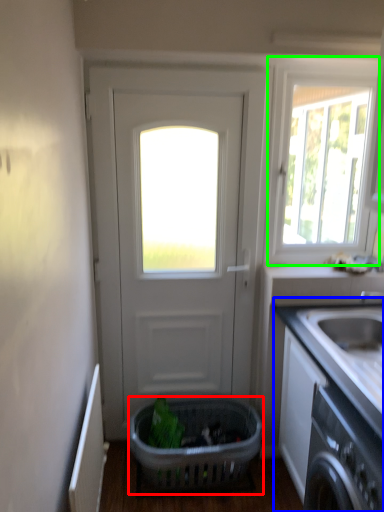
Question: Based on their relative distances, which object is farther from basket (highlighted by a red box)? Choose from countertop (highlighted by a blue box) and window (highlighted by a green box).

Choices:
 (A) countertop
 (B) window

Answer: (B)